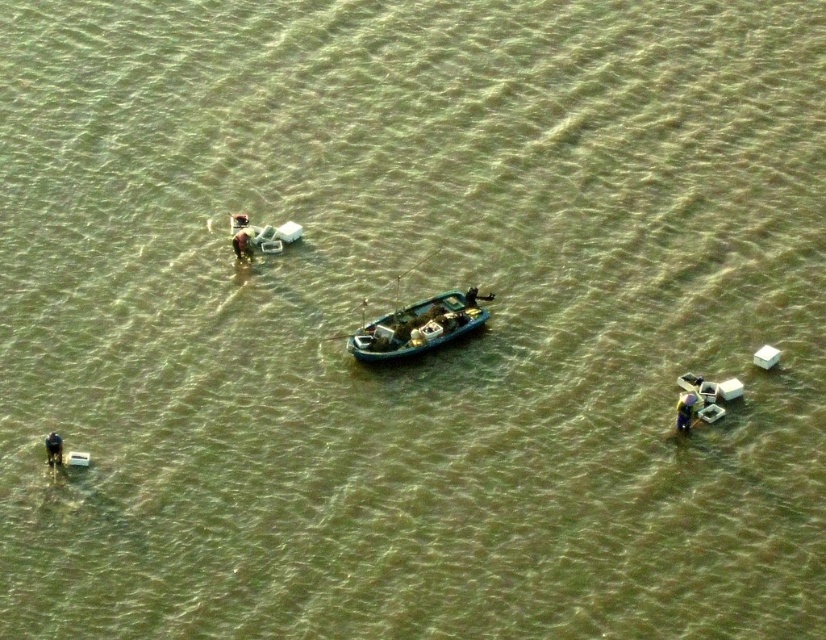
Between green fabric person at lower right and dark blue fabric person at center, which one appears on the left side from the viewer's perspective?

dark blue fabric person at center is more to the left.

Which of these two, green fabric person at lower right or dark blue fabric person at center, stands taller?

green fabric person at lower right

Find the location of `green fabric person at lower right`. green fabric person at lower right is located at coordinates (686, 410).

Does point (687, 406) come behind point (55, 451)?

Yes, point (687, 406) is farther from viewer.

The image size is (826, 640). Identify the location of green fabric person at lower right. (686, 410).

Is dark blue fabric person at lower left to the right of dark blue fabric person at center from the viewer's perspective?

In fact, dark blue fabric person at lower left is to the left of dark blue fabric person at center.

Is point (50, 461) farther from viewer compared to point (483, 298)?

No, it is not.

Is point (55, 452) positioned after point (468, 296)?

That is False.

You are a GUI agent. You are given a task and a screenshot of the screen. Output one action in this format:
    pyautogui.click(x=<x>, y=<y>)
    Task: Click on the dark blue fabric person at lower left
    The image size is (826, 640).
    Given the screenshot: What is the action you would take?
    pyautogui.click(x=53, y=449)